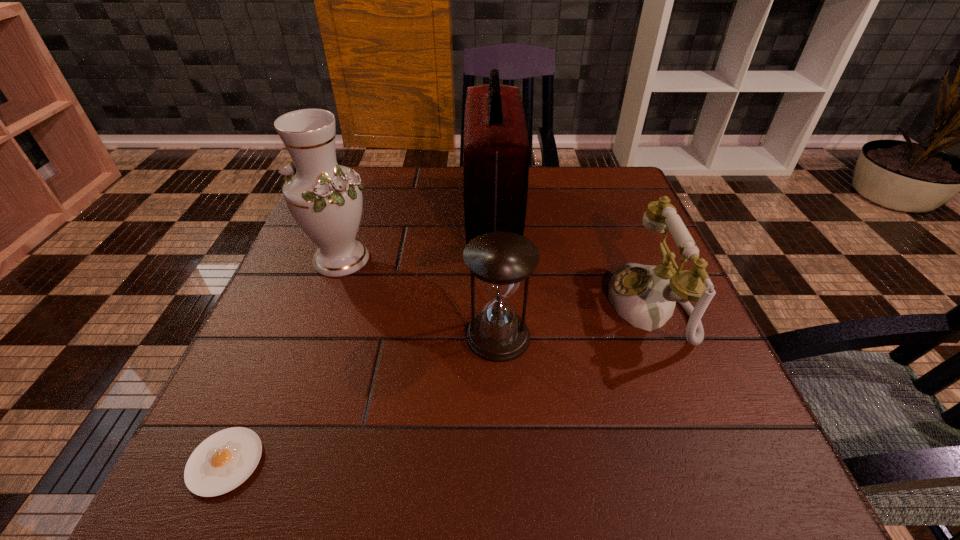
Where is `the first aid kit`? The width and height of the screenshot is (960, 540). the first aid kit is located at coordinates (496, 149).

Locate an element on the screen. The height and width of the screenshot is (540, 960). vase is located at coordinates (325, 199).

Locate an element on the screen. This screenshot has height=540, width=960. hourglass is located at coordinates (500, 260).

At what (x,y) coordinates should I click in order to perform the action: click on telephone. Please return your answer as a coordinate pair (x, y). Image resolution: width=960 pixels, height=540 pixels. Looking at the image, I should click on (645, 296).

At what (x,y) coordinates should I click in order to perform the action: click on the shortest object. Please return your answer as a coordinate pair (x, y). This screenshot has width=960, height=540. Looking at the image, I should click on (223, 461).

Identify the location of the nearest object. The height and width of the screenshot is (540, 960). (223, 461).

The height and width of the screenshot is (540, 960). What are the coordinates of `vacant space located 0.070m on the side of the first aid kit with the cross symbol` in the screenshot? It's located at [x=438, y=212].

Locate an element on the screen. This screenshot has width=960, height=540. vacant space located on the side of the first aid kit with the cross symbol is located at coordinates (438, 212).

This screenshot has width=960, height=540. Identify the location of vacant space located on the side of the first aid kit with the cross symbol. (358, 212).

I want to click on free spot located on the front of the vase, so click(305, 356).